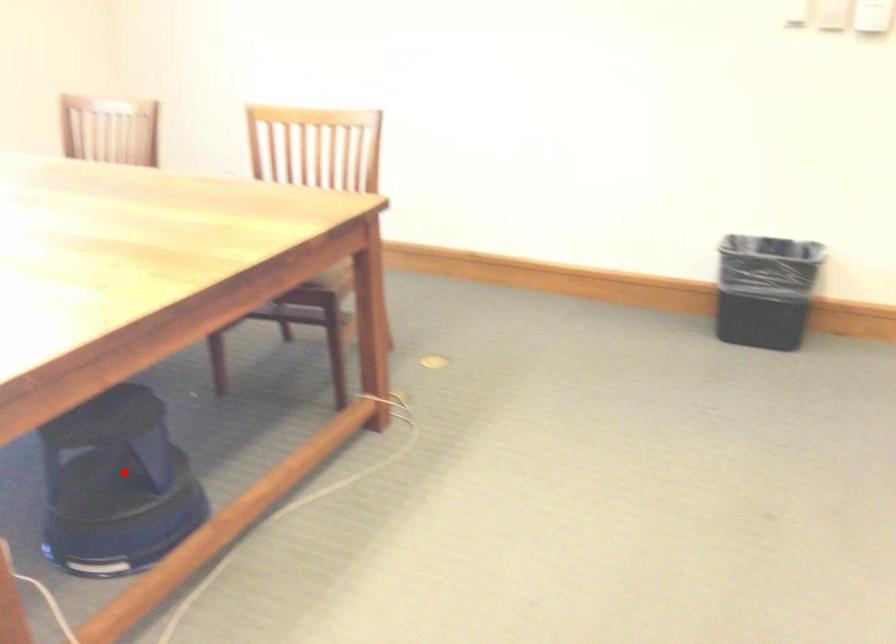
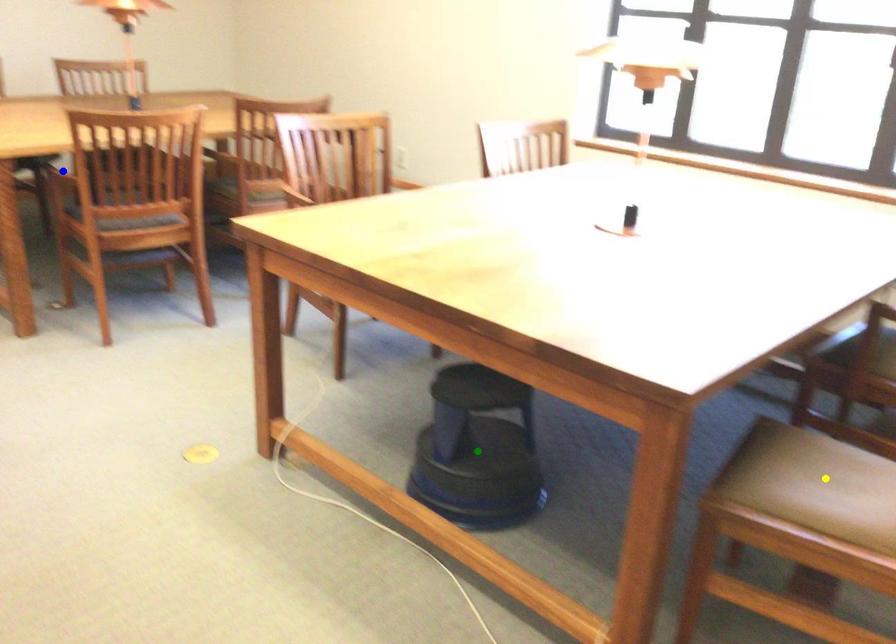
Question: I am providing you with two images of the same scene from different viewpoints. A red point is marked on the first image. You are given multiple points on the second image. In image 2, which mark is for the same physical point as the one in image 1?

Choices:
 (A) blue point
 (B) yellow point
 (C) green point

Answer: (C)